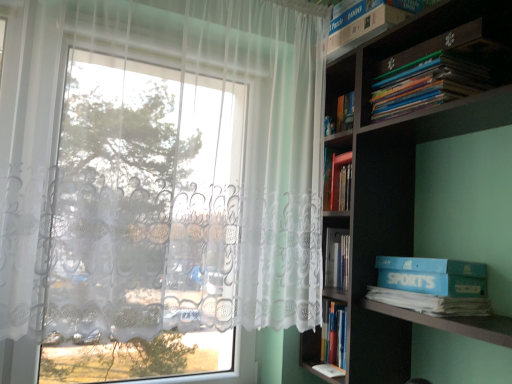
Question: Does point (361, 64) appear closer or farther from the camera than point (425, 291)?

Choices:
 (A) farther
 (B) closer

Answer: (A)

Question: Considering their positions, is wooden bookshelf at upper right located in front of or behind blue cardboard box at right?

Choices:
 (A) front
 (B) behind

Answer: (A)

Question: Estimate the real-world distances between objects in this image. Which object is farther from the hardcover books at center, the 2th book viewed from the top?

Choices:
 (A) wooden bookshelf at upper right
 (B) dark wood bookcase at right
 (C) blue cardboard box at right
 (D) white cardboard box at upper right, which appears as the 2th book when ordered from the bottom
 (E) white lace curtain at left

Answer: (D)

Question: Estimate the real-world distances between objects in this image. Which object is farther from the white lace curtain at left?

Choices:
 (A) dark wood bookcase at right
 (B) blue cardboard box at right
 (C) hardcover books at center, the 2th book viewed from the top
 (D) white cardboard box at upper right, which appears as the 2th book when ordered from the bottom
 (E) wooden bookshelf at upper right

Answer: (C)